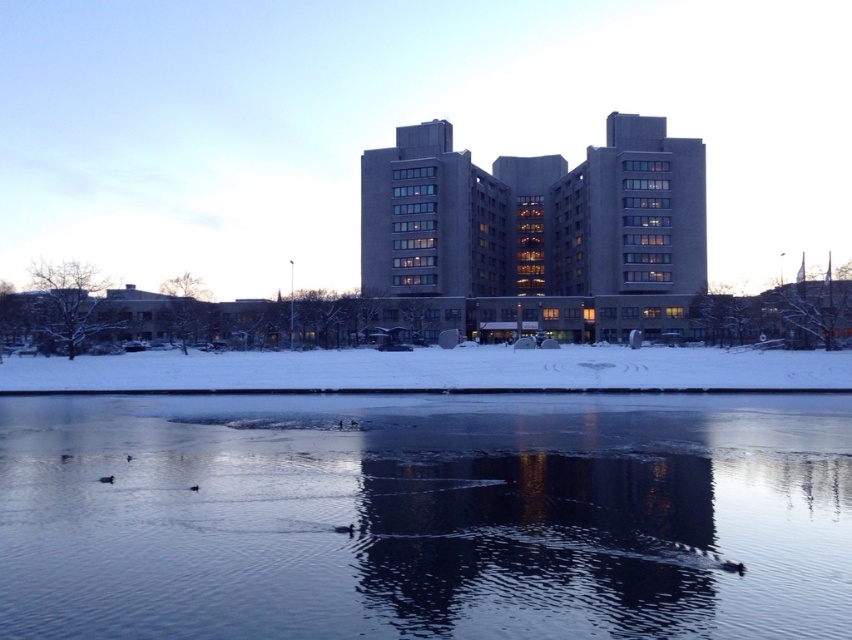
Question: Is transparent ice at center wider than gray concrete building at center?

Choices:
 (A) yes
 (B) no

Answer: (B)

Question: Which point is farther to the camera?

Choices:
 (A) (537, 164)
 (B) (557, 564)

Answer: (A)

Question: Can you confirm if transparent ice at center is thinner than gray concrete building at center?

Choices:
 (A) no
 (B) yes

Answer: (B)

Question: Which object is closer to the camera taking this photo?

Choices:
 (A) gray concrete building at center
 (B) transparent ice at center

Answer: (B)

Question: Is transparent ice at center smaller than gray concrete building at center?

Choices:
 (A) yes
 (B) no

Answer: (A)